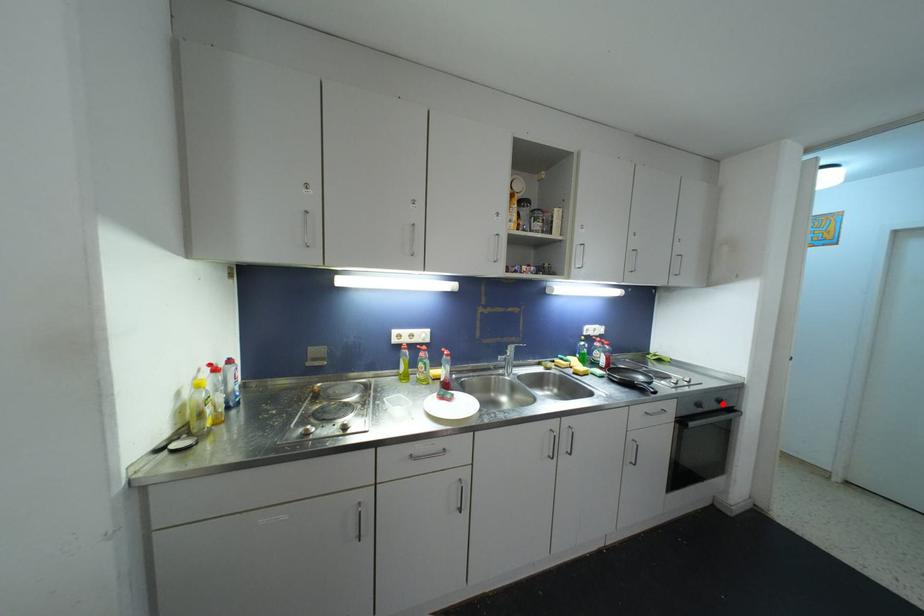
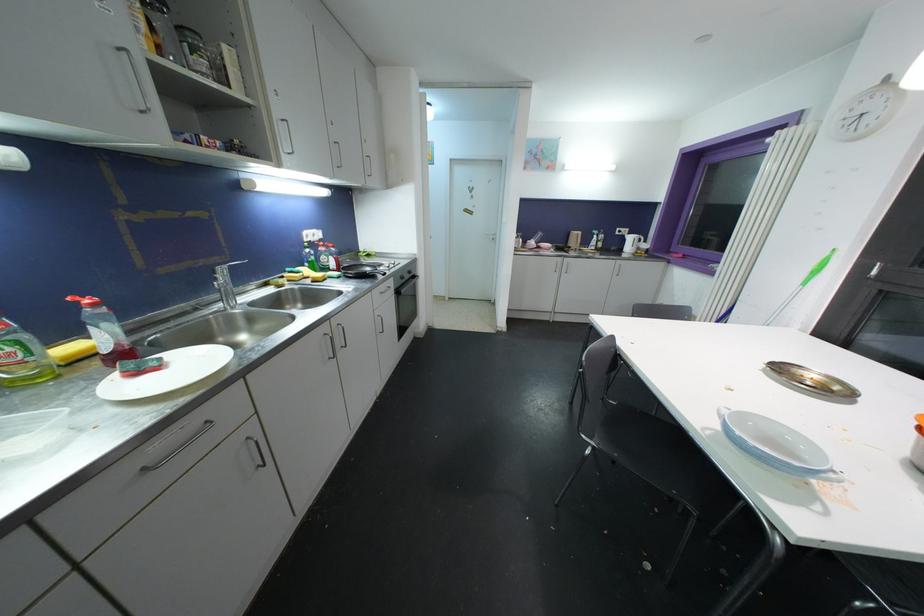
Question: I am providing you with two images of the same scene from different viewpoints. A red point is shown in image1. For the corresponding object point in image2, is it positioned nearer or farther from the camera?

Choices:
 (A) Nearer
 (B) Farther

Answer: (A)